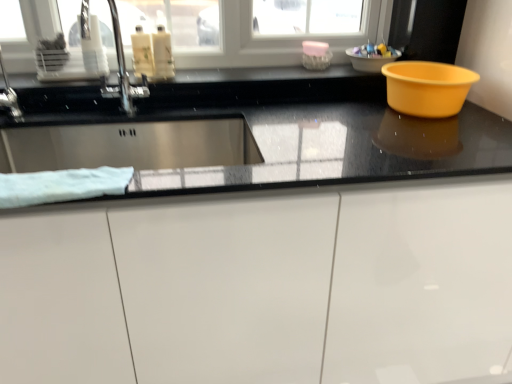
Question: Would you say translucent plastic bottles at upper center, the 2th liquid when ordered from right to left, is inside or outside plastic bowl at upper right?

Choices:
 (A) outside
 (B) inside

Answer: (A)

Question: Relative to plastic bowl at upper right, is translucent plastic bottles at upper center, the 2th liquid when ordered from right to left, in front or behind?

Choices:
 (A) behind
 (B) front

Answer: (B)

Question: Estimate the real-world distances between objects in this image. Which object is closer to the plastic bowl at upper right?

Choices:
 (A) white glossy cabinet at lower center
 (B) pink translucent soap at upper center
 (C) matte plastic bowl at upper right, the 2th basin when ordered from bottom to top
 (D) translucent plastic bottles at upper center, which ranks as the 2th liquid in left-to-right order
 (E) yellow plastic basin at right, the second basin when ordered from top to bottom

Answer: (C)

Question: Which object is positioned farthest from the white soft towel at left?

Choices:
 (A) pink translucent soap at upper center
 (B) metallic faucet at upper left
 (C) plastic bowl at upper right
 (D) matte plastic bowl at upper right, the 1th basin when ordered from top to bottom
 (E) white glossy cabinet at lower center

Answer: (C)